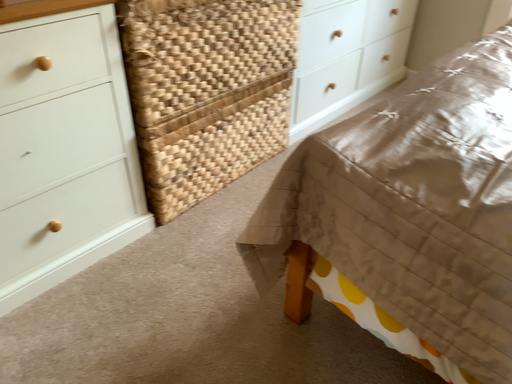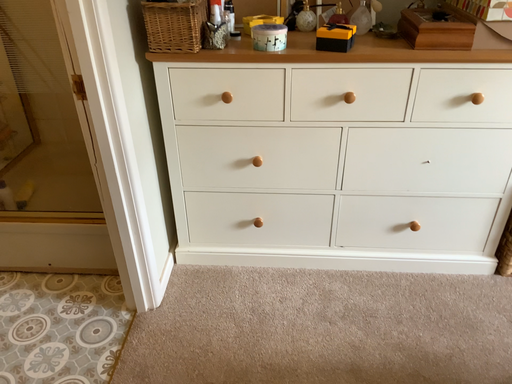
Question: How did the camera likely rotate when shooting the video?

Choices:
 (A) rotated upward
 (B) rotated downward

Answer: (A)